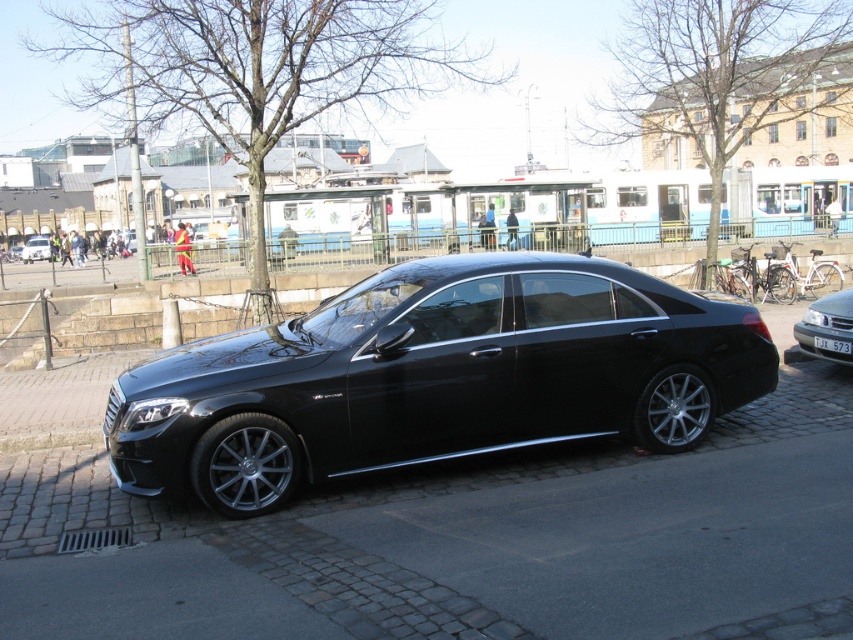
You are a delivery driver who needs to park your vehicle on the black asphalt at center. However, there is a shiny black sedan at center already occupying the space. Can you park your vehicle there without overlapping the sedan?

The black asphalt at center is located below the shiny black sedan at center, meaning the sedan is parked on the asphalt. Since the sedan is already occupying the space, you cannot park your vehicle there without overlapping it.

You are a delivery person trying to park your bike between the black asphalt at center and the black plastic license plate at center. Which object is taller so you can position your bike accordingly?

The black plastic license plate at center is taller than the black asphalt at center, so you should position your bike considering the height of the license plate to avoid obstruction.